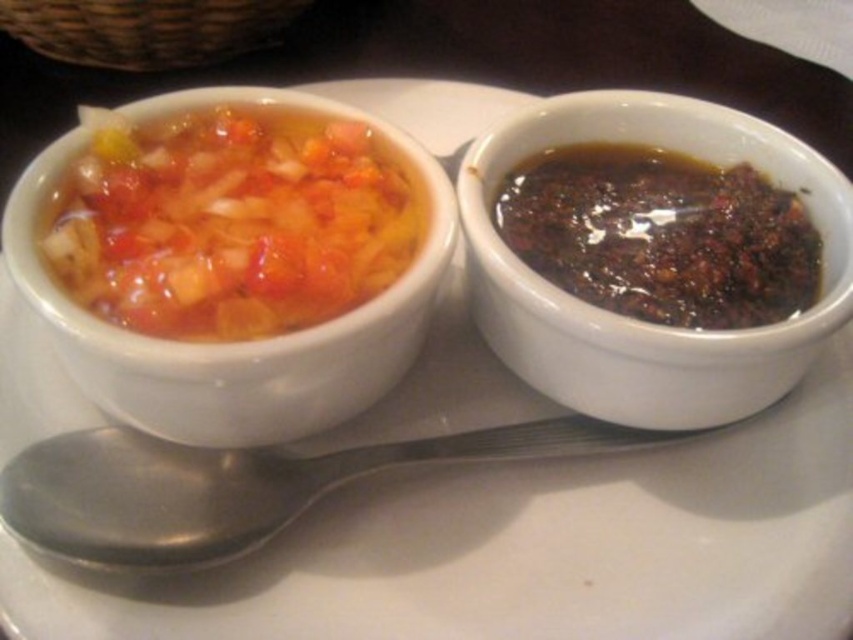
Looking at this image, which is below, matte ceramic bowl at upper left or silver metallic spoon at lower left?

silver metallic spoon at lower left

I want to click on matte ceramic bowl at upper left, so click(x=241, y=342).

Which is above, black glossy sauce at right or silver metallic spoon at lower left?

Positioned higher is black glossy sauce at right.

Is black glossy sauce at right below silver metallic spoon at lower left?

No.

Measure the distance between point (520, 316) and camera.

Point (520, 316) and camera are 25.00 inches apart from each other.

Identify the location of black glossy sauce at right. (636, 321).

Which is above, black glossy sauce at right or dark glossy sauce at right?

dark glossy sauce at right is above.

Is point (828, 170) closer to camera compared to point (817, 240)?

Yes, point (828, 170) is closer to viewer.

Where is `black glossy sauce at right`? black glossy sauce at right is located at coordinates (636, 321).